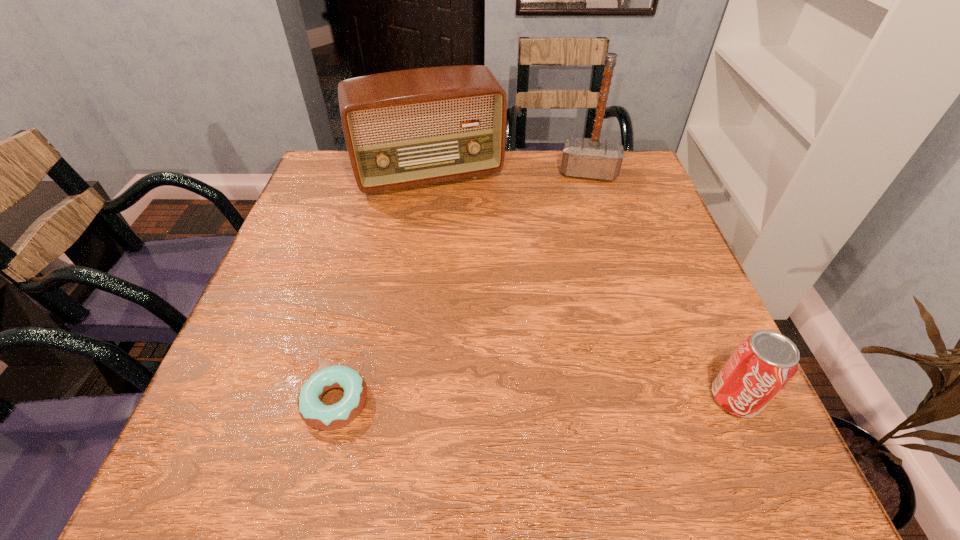
Image resolution: width=960 pixels, height=540 pixels. I want to click on free space located 0.240m on the striking surface of the tallest object, so click(584, 242).

Image resolution: width=960 pixels, height=540 pixels. I want to click on blank area located on the front-facing side of the radio receiver, so click(x=457, y=227).

This screenshot has width=960, height=540. Identify the location of vacant space located on the front-facing side of the radio receiver. (463, 243).

The width and height of the screenshot is (960, 540). I want to click on blank area located 0.380m on the front-facing side of the radio receiver, so click(x=488, y=310).

You are a GUI agent. You are given a task and a screenshot of the screen. Output one action in this format:
    pyautogui.click(x=<x>, y=<y>)
    Task: Click on the hammer positioned at the far edge
    
    Given the screenshot: What is the action you would take?
    pyautogui.click(x=582, y=157)

Locate an element on the screen. The height and width of the screenshot is (540, 960). radio receiver present at the far edge is located at coordinates (405, 128).

The width and height of the screenshot is (960, 540). Identify the location of doughnut that is at the near edge. (311, 409).

Locate an element on the screen. This screenshot has height=540, width=960. soda can that is at the near edge is located at coordinates (763, 363).

You are a GUI agent. You are given a task and a screenshot of the screen. Output one action in this format:
    pyautogui.click(x=<x>, y=<y>)
    Task: Click on the doughnut situated at the left edge
    
    Given the screenshot: What is the action you would take?
    pyautogui.click(x=311, y=409)

I want to click on radio receiver situated at the left edge, so click(x=405, y=128).